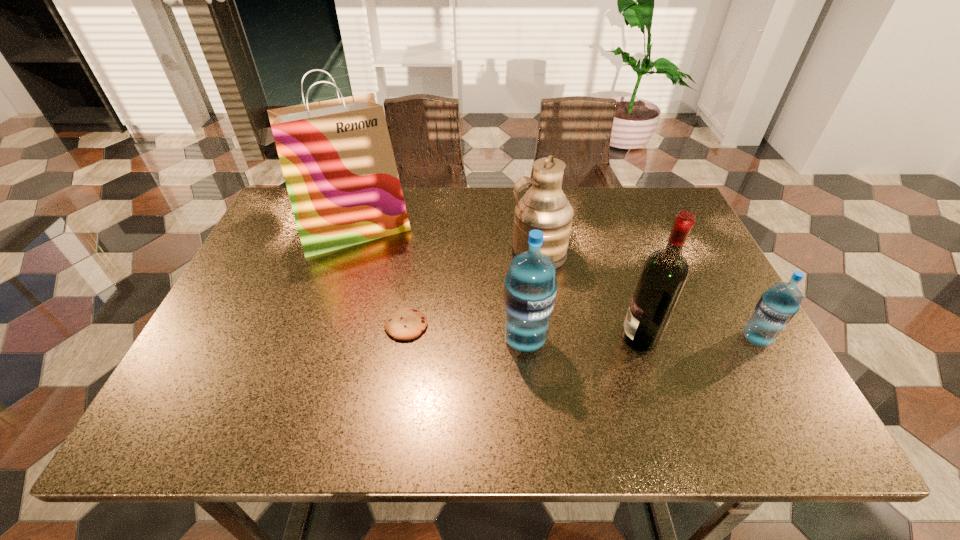
Please point a spot to add another water bottle on the left. Please provide its 2D coordinates. Your answer should be formatted as a tuple, i.e. [(x, y)], where the tuple contains the x and y coordinates of a point satisfying the conditions above.

[(293, 341)]